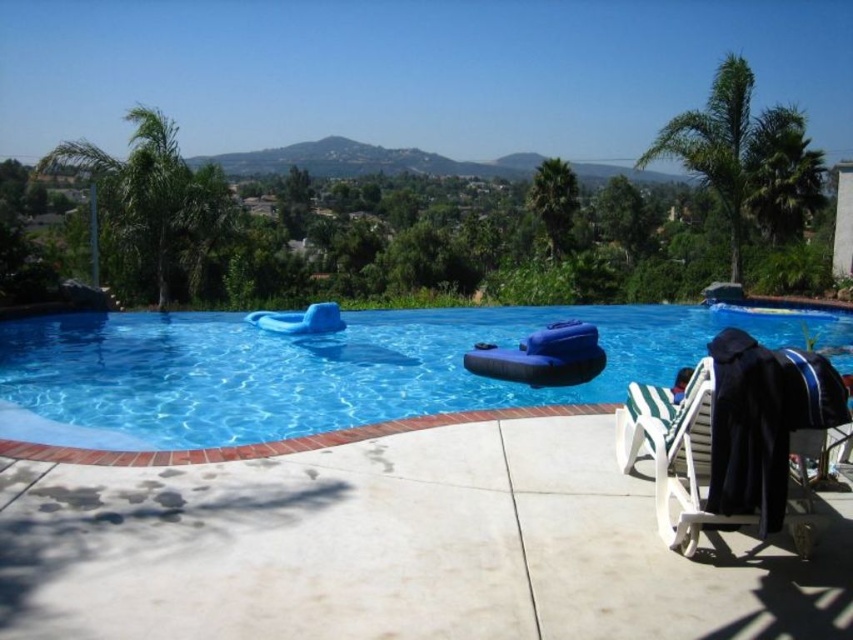
Who is more distant from viewer, [682,131] or [126,198]?

Positioned behind is point [682,131].

Is point (724, 145) positioned before point (114, 221)?

Yes, it is in front of point (114, 221).

Identify the location of green leafy palm tree at upper right. This screenshot has width=853, height=640. (746, 157).

Does point (776, 120) lie behind point (560, 195)?

No, it is not.

Is green leafy palm tree at upper right thinner than green leafy palm tree at upper center?

In fact, green leafy palm tree at upper right might be wider than green leafy palm tree at upper center.

Identify the location of green leafy palm tree at upper right. (746, 157).

Is blue rubber float at center below green leafy palm tree at upper left?

Yes, blue rubber float at center is below green leafy palm tree at upper left.

Who is more distant from viewer, (819, 328) or (195, 241)?

Positioned behind is point (195, 241).

Identify the location of blue rubber float at center. Image resolution: width=853 pixels, height=640 pixels. (318, 369).

Locate an element on the screen. This screenshot has width=853, height=640. blue rubber float at center is located at coordinates (318, 369).